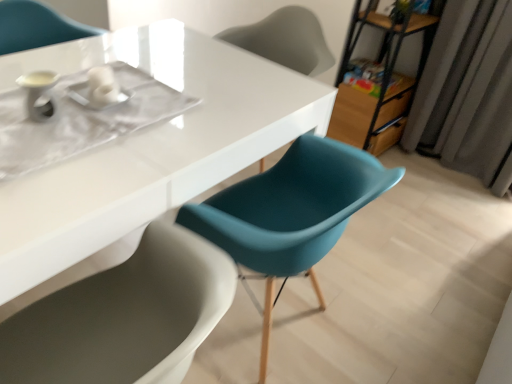
Question: Should I look upward or downward to see metallic brown bookshelf at upper right?

Choices:
 (A) down
 (B) up

Answer: (B)

Question: Can you confirm if matte teal chair at center, which appears as the first chair when ordered from the bottom, is bigger than gray fabric curtain at right?

Choices:
 (A) yes
 (B) no

Answer: (A)

Question: Is matte teal chair at center, which appears as the first chair when ordered from the bottom, outside of gray fabric curtain at right?

Choices:
 (A) no
 (B) yes

Answer: (B)

Question: Can you confirm if matte teal chair at center, which ranks as the 1th chair in front-to-back order, is thinner than gray fabric curtain at right?

Choices:
 (A) yes
 (B) no

Answer: (B)

Question: Could you tell me if matte teal chair at center, which ranks as the 1th chair in front-to-back order, is facing gray fabric curtain at right?

Choices:
 (A) yes
 (B) no

Answer: (B)

Question: From the image's perspective, is matte teal chair at center, which is counted as the 2th chair, starting from the back, located above gray fabric curtain at right?

Choices:
 (A) yes
 (B) no

Answer: (B)

Question: Can you confirm if matte teal chair at center, which ranks as the 1th chair in front-to-back order, is wider than gray fabric curtain at right?

Choices:
 (A) yes
 (B) no

Answer: (A)

Question: Is white glossy table at center at the back of matte teal chair at upper center, positioned as the 1th chair in back-to-front order?

Choices:
 (A) no
 (B) yes

Answer: (A)

Question: Is matte teal chair at upper center, which is the 2th chair in front-to-back order, outside white glossy table at center?

Choices:
 (A) no
 (B) yes

Answer: (B)

Question: Could you tell me if matte teal chair at upper center, which appears as the second chair when ordered from the bottom, is facing white glossy table at center?

Choices:
 (A) no
 (B) yes

Answer: (B)

Question: From a real-world perspective, does matte teal chair at upper center, the 1th chair in the top-to-bottom sequence, stand above white glossy table at center?

Choices:
 (A) yes
 (B) no

Answer: (A)

Question: Is matte teal chair at upper center, the 1th chair in the top-to-bottom sequence, shorter than white glossy table at center?

Choices:
 (A) yes
 (B) no

Answer: (A)

Question: From the image's perspective, is matte teal chair at upper center, positioned as the 1th chair in back-to-front order, under white glossy table at center?

Choices:
 (A) no
 (B) yes

Answer: (A)

Question: From the image's perspective, is white glossy table at center on top of matte teal chair at center, which is counted as the 2th chair, starting from the back?

Choices:
 (A) yes
 (B) no

Answer: (A)